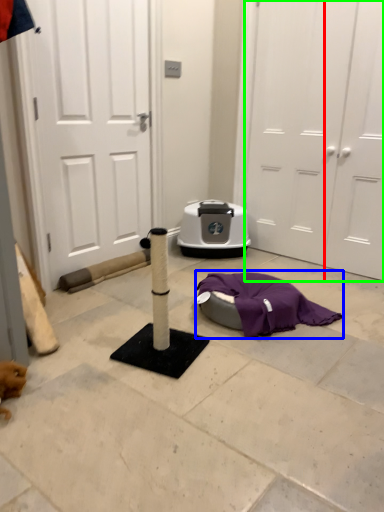
Question: Which object is positioned closest to door (highlighted by a red box)? Select from blanket (highlighted by a blue box) and door (highlighted by a green box).

Choices:
 (A) blanket
 (B) door

Answer: (B)